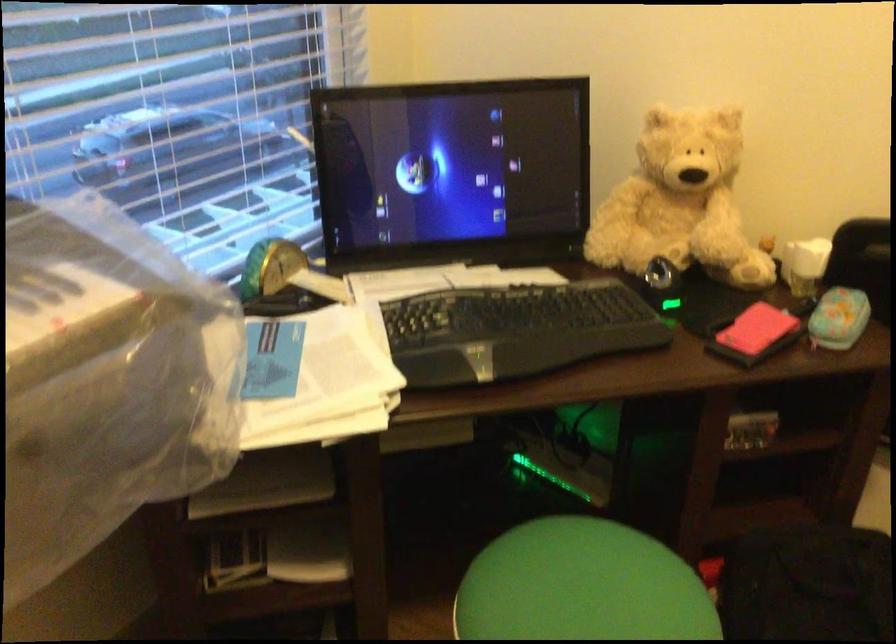
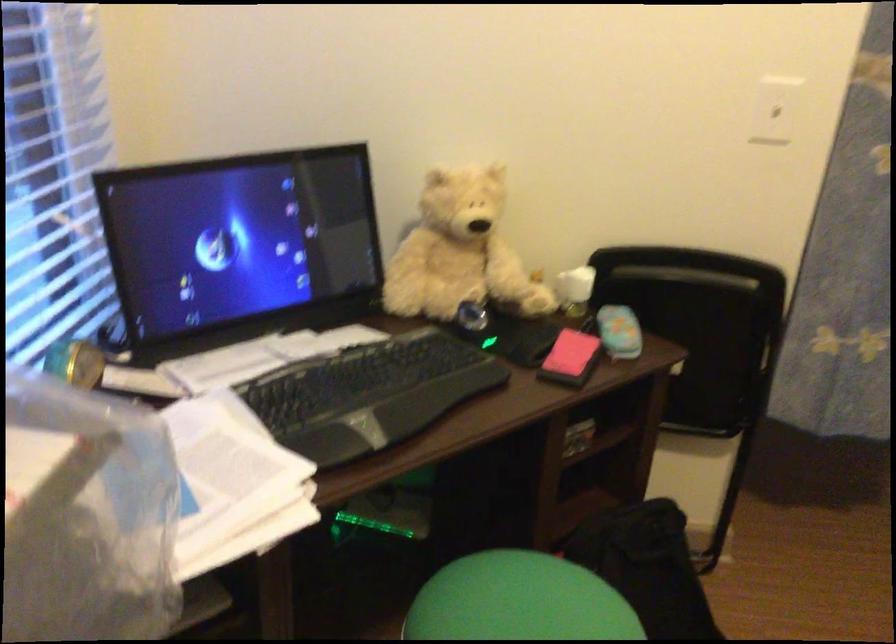
Question: How did the camera likely rotate?

Choices:
 (A) Left
 (B) Right
 (C) Up
 (D) Down

Answer: (B)